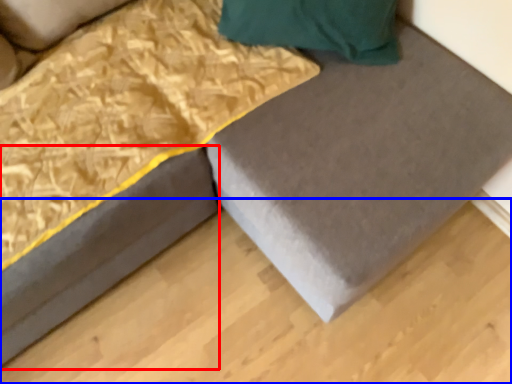
Question: Which object is further to the camera taking this photo, bed frame (highlighted by a red box) or plywood (highlighted by a blue box)?

Choices:
 (A) bed frame
 (B) plywood

Answer: (B)